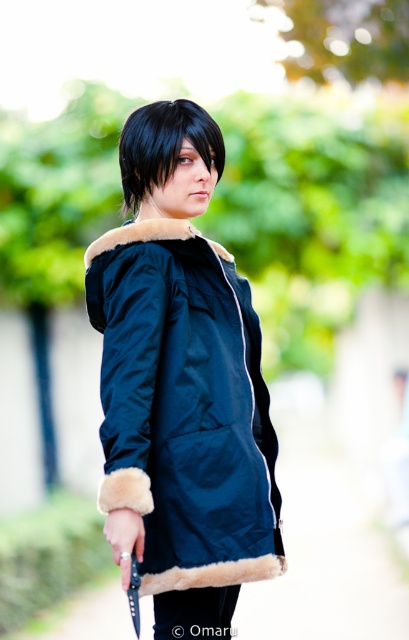
Can you confirm if navy blue fur-lined jacket at center is positioned to the right of black matte hair at center?

Correct, you'll find navy blue fur-lined jacket at center to the right of black matte hair at center.

Is navy blue fur-lined jacket at center bigger than black matte hair at center?

Yes, navy blue fur-lined jacket at center is bigger than black matte hair at center.

Between point (87, 276) and point (145, 116), which one is positioned in front?

Point (87, 276) is in front.

Locate an element on the screen. navy blue fur-lined jacket at center is located at coordinates (184, 404).